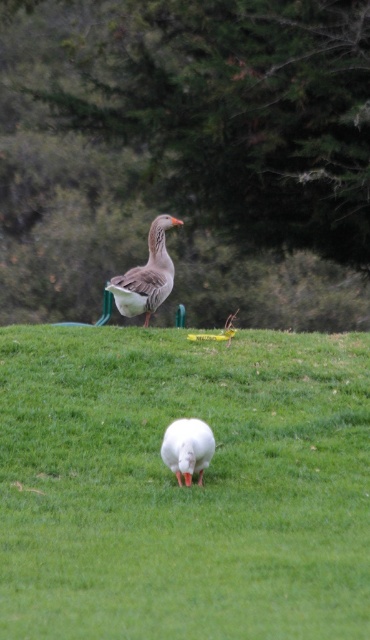
Who is lower down, white grass at center or gray matte duck at center?

white grass at center is lower down.

Between white grass at center and gray matte duck at center, which one appears on the right side from the viewer's perspective?

white grass at center is more to the right.

Does point (358, 476) come behind point (126, 291)?

That is False.

At what (x,y) coordinates should I click in order to perform the action: click on white grass at center. Please return your answer as a coordinate pair (x, y). The width and height of the screenshot is (370, 640). Looking at the image, I should click on (183, 486).

Between point (142, 292) and point (204, 465), which one is positioned in front?

Point (204, 465) is in front.

Is point (160, 276) closer to viewer compared to point (172, 448)?

That is False.

The width and height of the screenshot is (370, 640). I want to click on gray matte duck at center, so click(146, 275).

Image resolution: width=370 pixels, height=640 pixels. Find the location of `gray matte duck at center`. gray matte duck at center is located at coordinates pos(146,275).

Image resolution: width=370 pixels, height=640 pixels. What do you see at coordinates (183, 486) in the screenshot? I see `white grass at center` at bounding box center [183, 486].

Is white grass at center taller than white matte duck at center?

In fact, white grass at center may be shorter than white matte duck at center.

Which is in front, point (123, 480) or point (183, 426)?

Point (183, 426) is in front.

Locate an element on the screen. This screenshot has height=640, width=370. white grass at center is located at coordinates (183, 486).